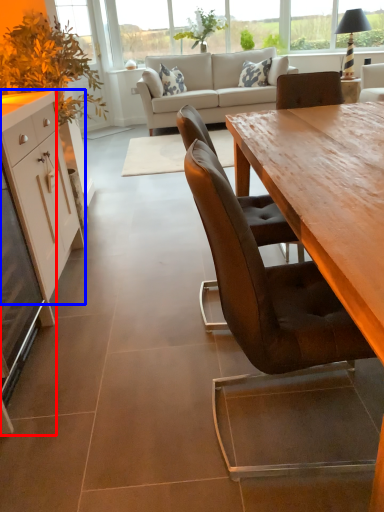
Question: Which of the following is the closest to the observer, desk (highlighted by a red box) or cabinetry (highlighted by a blue box)?

Choices:
 (A) desk
 (B) cabinetry

Answer: (A)